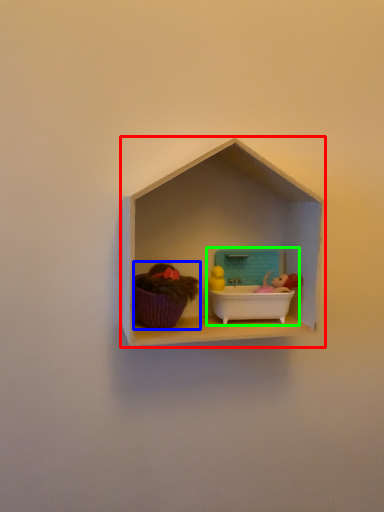
Question: Considering the real-world distances, which object is closest to shelf (highlighted by a red box)? toy (highlighted by a blue box) or lunch box (highlighted by a green box).

Choices:
 (A) toy
 (B) lunch box

Answer: (B)